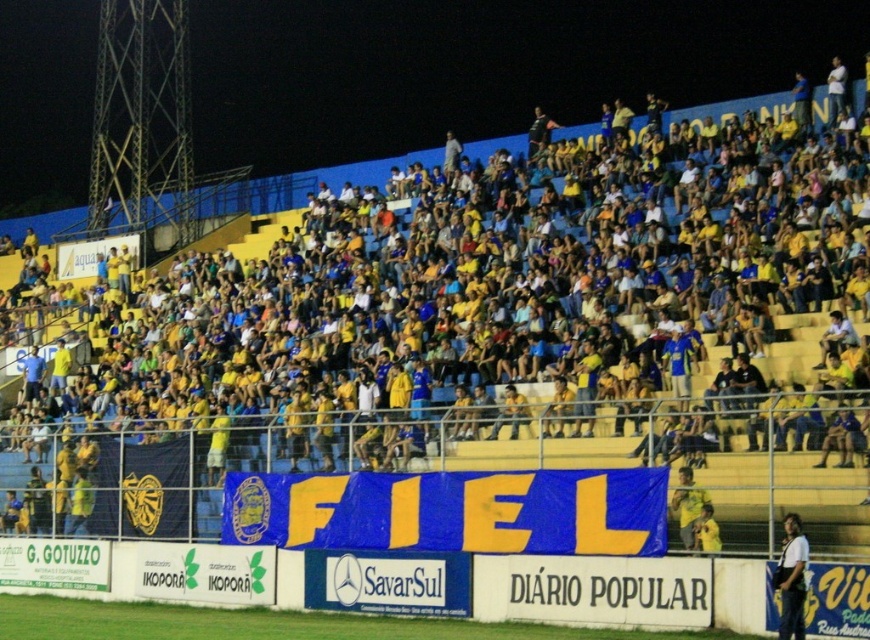
I want to click on white shirt at lower right, so click(x=791, y=579).

I want to click on white shirt at lower right, so click(791, 579).